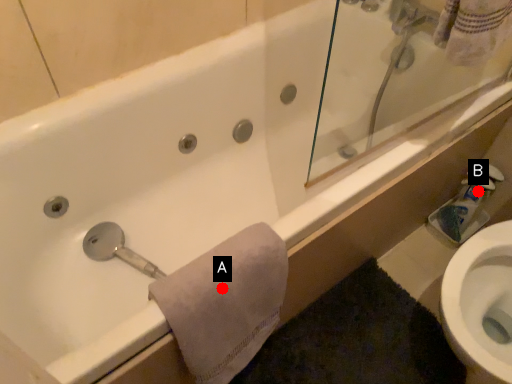
Question: Two points are circled on the image, labeled by A and B beside each circle. Which of the following is the closest to the observer?

Choices:
 (A) A is closer
 (B) B is closer

Answer: (A)